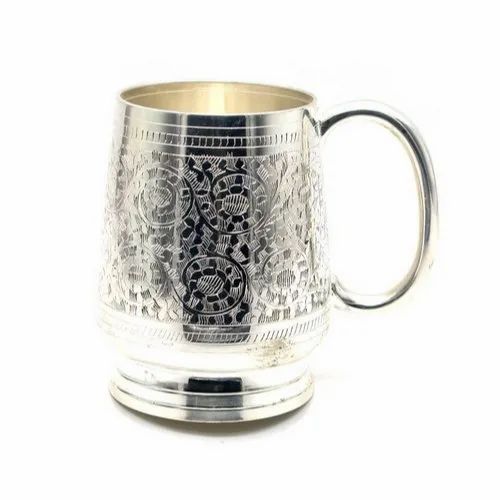
Where is `cup`? This screenshot has height=500, width=500. cup is located at coordinates (270, 207).